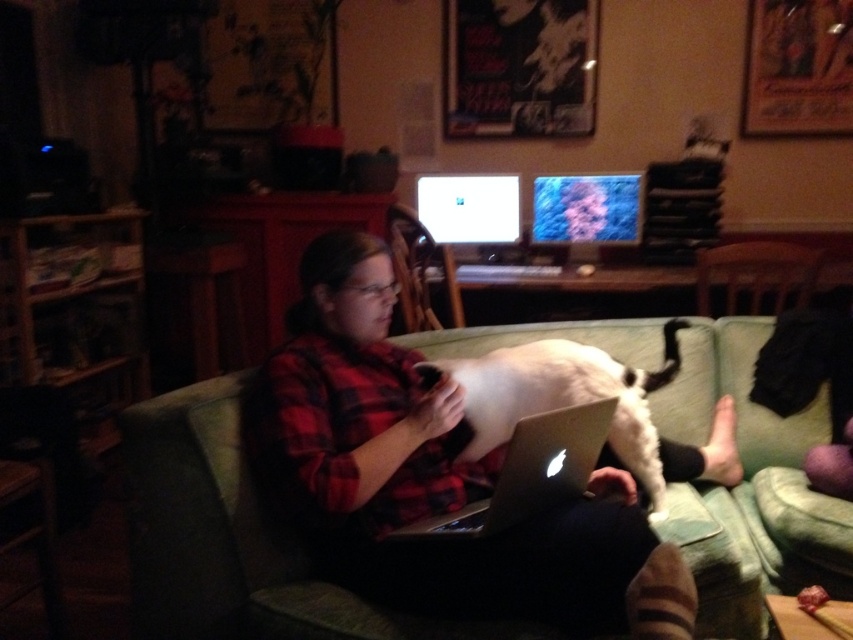
Between white fur cat at center and matte plastic monitor at upper center, which one has less height?

matte plastic monitor at upper center

Measure the distance from white fur cat at center to matte plastic monitor at upper center.

white fur cat at center and matte plastic monitor at upper center are 1.76 meters apart from each other.

Which is behind, point (613, 422) or point (584, 259)?

Point (584, 259)

Identify the location of white fur cat at center. (560, 397).

Does green fabric couch at center have a greater height compared to matte plastic chair at center?

Yes, green fabric couch at center is taller than matte plastic chair at center.

Image resolution: width=853 pixels, height=640 pixels. Describe the element at coordinates (234, 540) in the screenshot. I see `green fabric couch at center` at that location.

The image size is (853, 640). I want to click on green fabric couch at center, so click(x=234, y=540).

Does silver metallic laptop at center have a greater width compared to matte plastic chair at center?

Yes, silver metallic laptop at center is wider than matte plastic chair at center.

Who is positioned more to the left, silver metallic laptop at center or matte plastic chair at center?

Positioned to the left is matte plastic chair at center.

Between point (547, 465) and point (422, 236), which one is positioned behind?

The point (422, 236) is more distant.

Identify the location of silver metallic laptop at center. (529, 472).